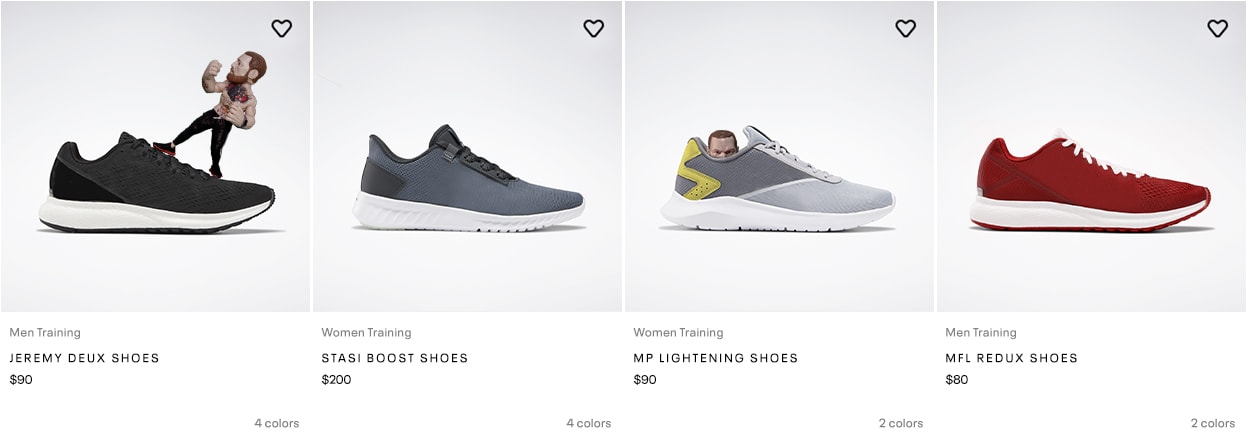
Locate an element on the screen. This screenshot has width=1248, height=446. action figure is located at coordinates (235, 106).